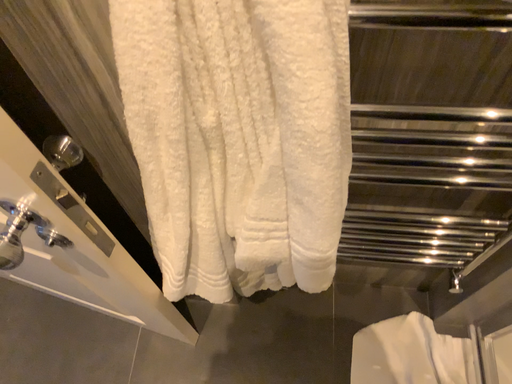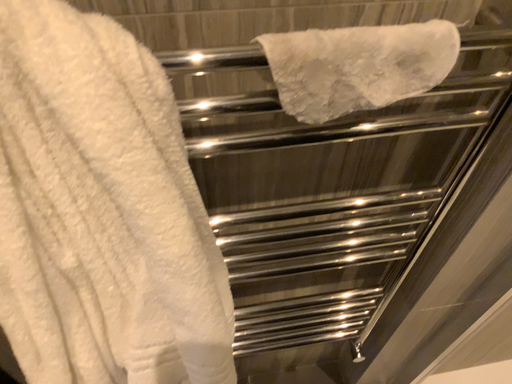
Question: Which way did the camera rotate in the video?

Choices:
 (A) rotated right
 (B) rotated left

Answer: (A)